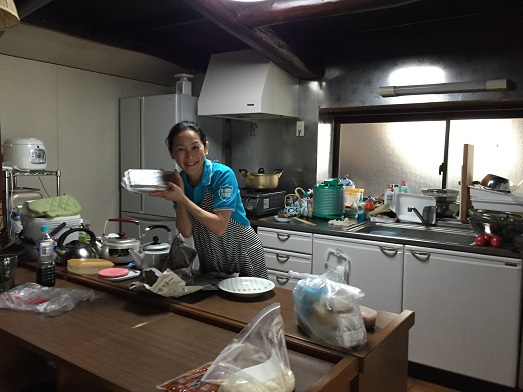
Image resolution: width=523 pixels, height=392 pixels. Find the location of `fridge`. fridge is located at coordinates (159, 115).